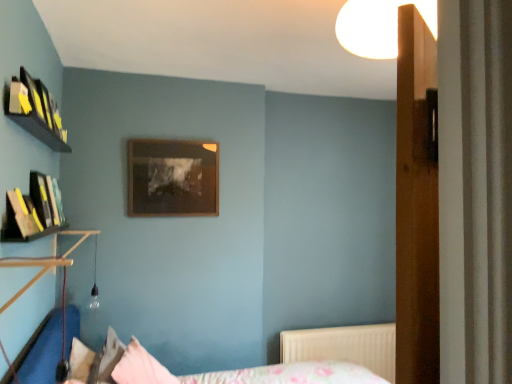
Question: Should I look upward or downward to see floral fabric bed at lower center?

Choices:
 (A) up
 (B) down

Answer: (B)

Question: From a real-world perspective, is floral fabric bed at lower center under white textured radiator at lower right?

Choices:
 (A) no
 (B) yes

Answer: (A)

Question: From a real-world perspective, is floral fabric bed at lower center located higher than white textured radiator at lower right?

Choices:
 (A) no
 (B) yes

Answer: (B)

Question: Would you consider floral fabric bed at lower center to be distant from white textured radiator at lower right?

Choices:
 (A) yes
 (B) no

Answer: (B)

Question: Does floral fabric bed at lower center have a greater width compared to white textured radiator at lower right?

Choices:
 (A) yes
 (B) no

Answer: (A)

Question: From the image's perspective, would you say floral fabric bed at lower center is positioned over white textured radiator at lower right?

Choices:
 (A) yes
 (B) no

Answer: (A)

Question: Can you confirm if floral fabric bed at lower center is taller than white textured radiator at lower right?

Choices:
 (A) yes
 (B) no

Answer: (A)

Question: Does wooden picture frame at center appear on the left side of fluffy pink pillow at lower left, the 1th pillow when ordered from left to right?

Choices:
 (A) yes
 (B) no

Answer: (B)

Question: Is wooden picture frame at center located outside fluffy pink pillow at lower left, the 1th pillow when ordered from left to right?

Choices:
 (A) yes
 (B) no

Answer: (A)

Question: Does wooden picture frame at center have a smaller size compared to fluffy pink pillow at lower left, the 1th pillow when ordered from left to right?

Choices:
 (A) no
 (B) yes

Answer: (A)

Question: Is wooden picture frame at center oriented towards fluffy pink pillow at lower left, which appears as the 2th pillow when viewed from the right?

Choices:
 (A) yes
 (B) no

Answer: (B)

Question: Is wooden picture frame at center taller than fluffy pink pillow at lower left, the 1th pillow when ordered from left to right?

Choices:
 (A) no
 (B) yes

Answer: (B)

Question: From a real-world perspective, is wooden picture frame at center on top of fluffy pink pillow at lower left, the 1th pillow when ordered from left to right?

Choices:
 (A) yes
 (B) no

Answer: (A)

Question: Considering the relative positions of pink fabric pillow at lower center, which appears as the 1th pillow when viewed from the right, and fluffy pink pillow at lower left, the 1th pillow when ordered from left to right, in the image provided, is pink fabric pillow at lower center, which appears as the 1th pillow when viewed from the right, to the right of fluffy pink pillow at lower left, the 1th pillow when ordered from left to right, from the viewer's perspective?

Choices:
 (A) no
 (B) yes

Answer: (B)